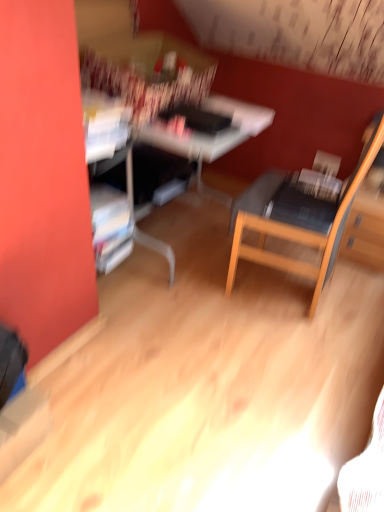
Where is `vacant space in front of white glossy computer desk at center`? Image resolution: width=384 pixels, height=512 pixels. vacant space in front of white glossy computer desk at center is located at coordinates (188, 396).